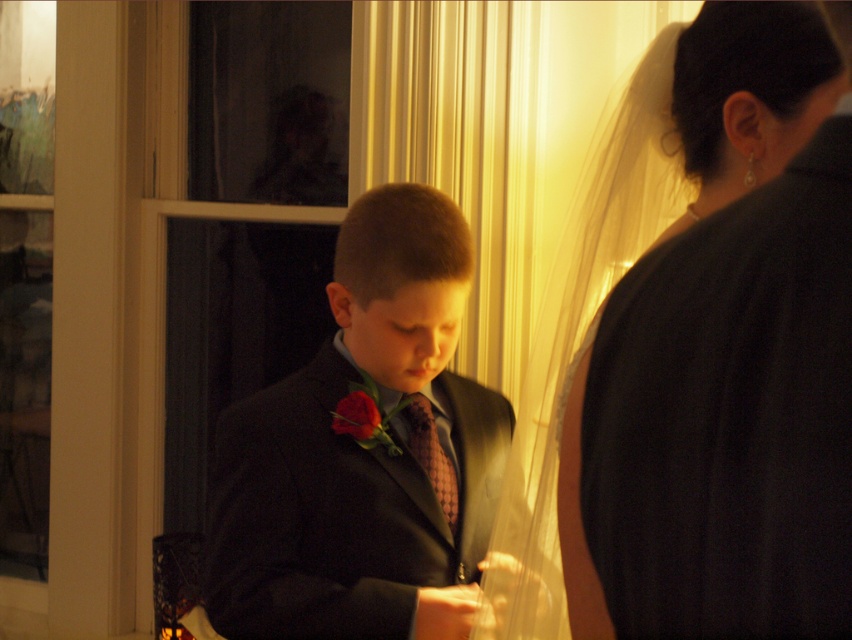
Question: Which object appears closest to the camera in this image?

Choices:
 (A) pink textured tie at center
 (B) silky white veil at upper right
 (C) shiny black suit at center

Answer: (B)

Question: Is silky white veil at upper right closer to the viewer compared to pink textured tie at center?

Choices:
 (A) yes
 (B) no

Answer: (A)

Question: Can you confirm if shiny black suit at center is positioned below silky white veil at upper right?

Choices:
 (A) no
 (B) yes

Answer: (B)

Question: Among these points, which one is nearest to the camera?

Choices:
 (A) (441, 483)
 (B) (694, 168)

Answer: (B)

Question: Does silky white veil at upper right have a larger size compared to pink textured tie at center?

Choices:
 (A) yes
 (B) no

Answer: (A)

Question: Which object appears closest to the camera in this image?

Choices:
 (A) pink textured tie at center
 (B) shiny black suit at center

Answer: (B)